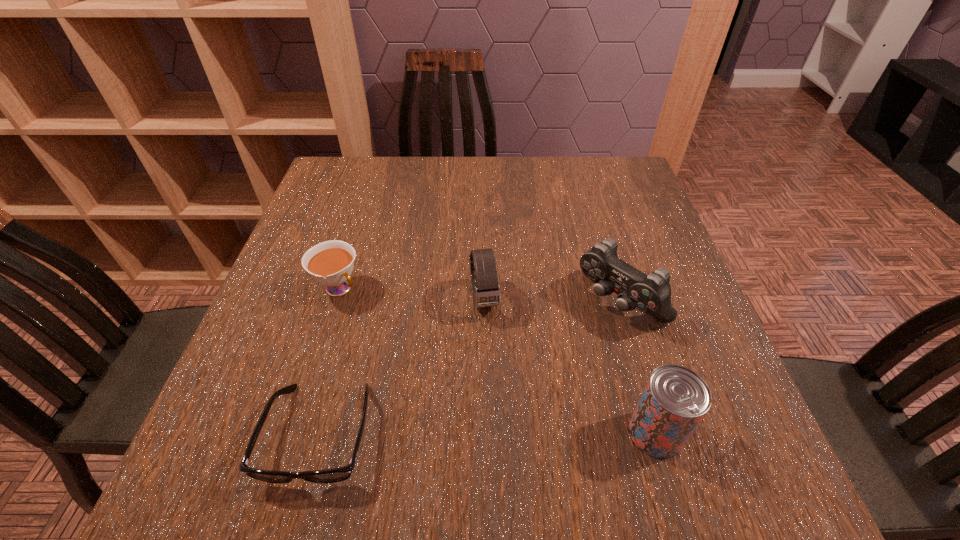
The height and width of the screenshot is (540, 960). I want to click on vacant space positioned on the side of the teacup with the handle, so click(413, 352).

At what (x,y) coordinates should I click in order to perform the action: click on vacant space located on the side of the teacup with the handle. Please return your answer as a coordinate pair (x, y). This screenshot has width=960, height=540. Looking at the image, I should click on (420, 357).

Find the location of `free space located 0.280m on the surface of the control with buttons`. free space located 0.280m on the surface of the control with buttons is located at coordinates (493, 413).

At what (x,y) coordinates should I click in order to perform the action: click on vacant point located on the surface of the control with buttons. Please return your answer as a coordinate pair (x, y). Image resolution: width=960 pixels, height=540 pixels. Looking at the image, I should click on (x=533, y=378).

Where is `vacant space located on the surface of the control with buttons`? The image size is (960, 540). vacant space located on the surface of the control with buttons is located at coordinates (562, 353).

Image resolution: width=960 pixels, height=540 pixels. I want to click on spectacles that is at the near edge, so click(340, 474).

Where is `beer can located in the near edge section of the desktop`? beer can located in the near edge section of the desktop is located at coordinates (675, 399).

The image size is (960, 540). What are the coordinates of `spectacles positioned at the left edge` in the screenshot? It's located at [340, 474].

Identify the location of teacup that is at the left edge. (331, 263).

Where is `beer can present at the right edge`? The height and width of the screenshot is (540, 960). beer can present at the right edge is located at coordinates (675, 399).